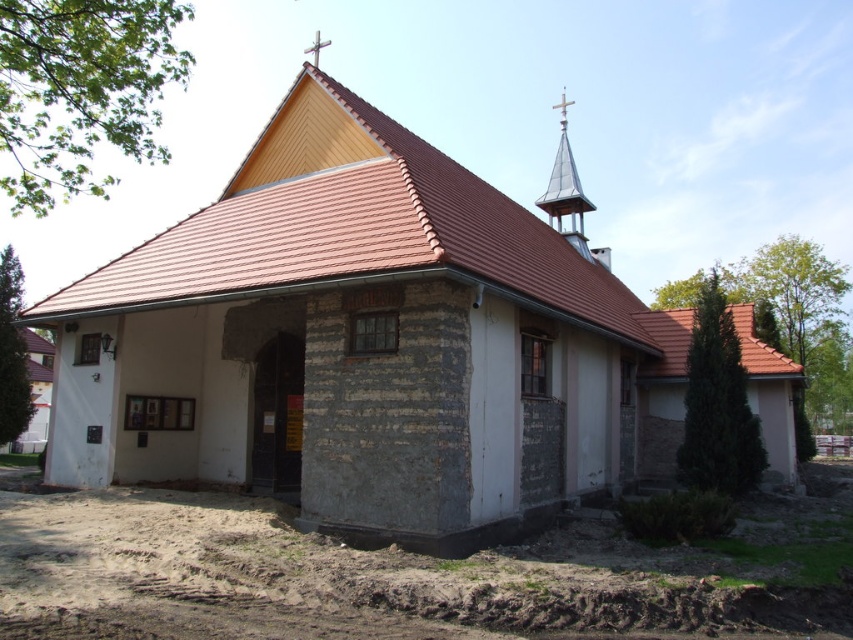
You are standing at the base of the church and want to place a new flower bed between the brown soil at lower left and the shiny silver spire at upper right. If the flower bed requires a space of 20 meters, will there be enough room?

The distance between the brown soil at lower left and the shiny silver spire at upper right is 22.12 meters, which is more than enough to accommodate the 20 meters required for the flower bed.

You are standing in front of the church and notice the brown soil at lower left and the shiny silver spire at upper right. Which object is taller?

The shiny silver spire at upper right is taller than the brown soil at lower left.

You are standing at the point marked as point (759, 545) and want to take a photo of the church. If your camera is 37 feet away from the point, will you be able to capture the entire church in your photo?

The point (759, 545) is 37.00 feet away from the camera. Since the camera is positioned at that distance, you should be able to capture the entire church in the photo as the distance allows for a wide enough view.